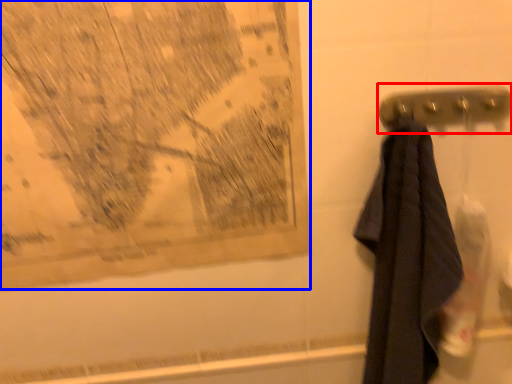
Question: Which object is further to the camera taking this photo, towel bar (highlighted by a red box) or map (highlighted by a blue box)?

Choices:
 (A) towel bar
 (B) map

Answer: (A)